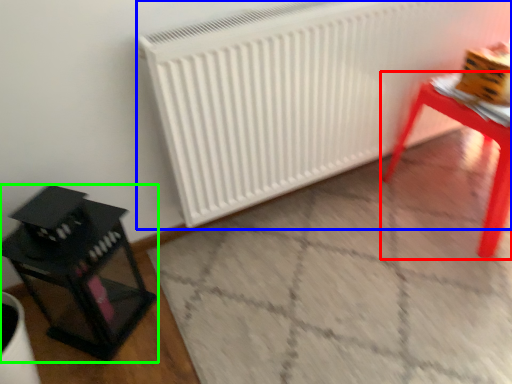
Question: Estimate the real-world distances between objects in this image. Which object is farther from table (highlighted by a red box), radiator (highlighted by a blue box) or furniture (highlighted by a green box)?

Choices:
 (A) radiator
 (B) furniture

Answer: (B)